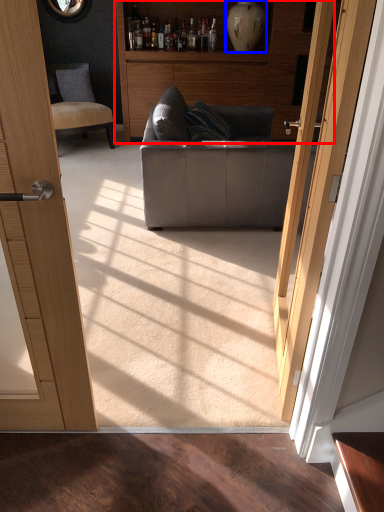
Question: Which object is closer to the camera taking this photo, cabinetry (highlighted by a red box) or vase (highlighted by a blue box)?

Choices:
 (A) cabinetry
 (B) vase

Answer: (A)